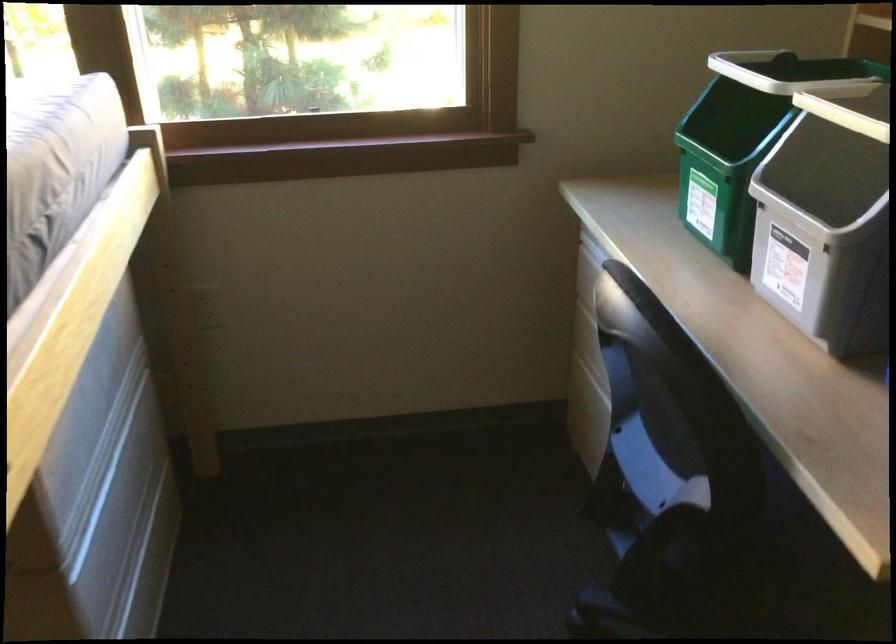
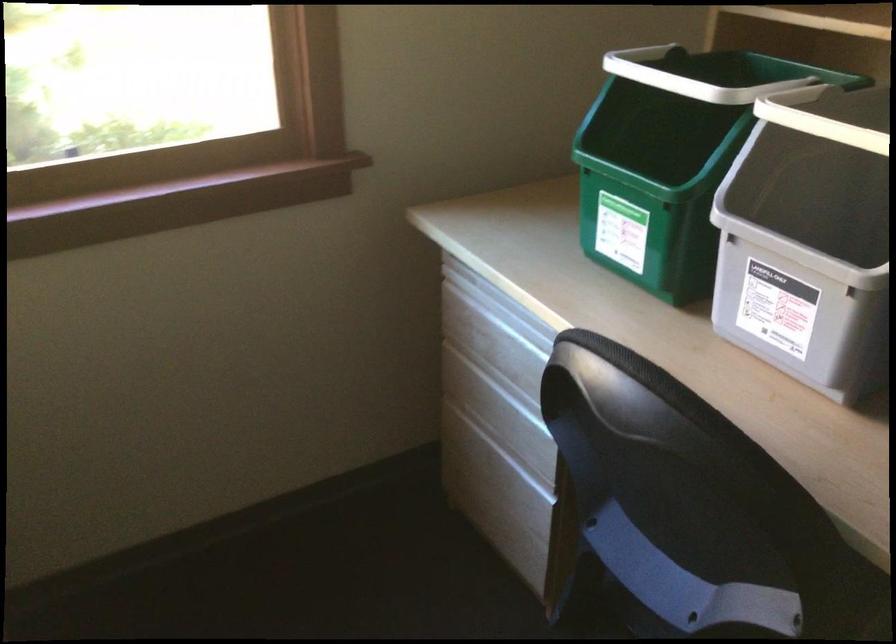
Looking at this image, in a continuous first-person perspective shot, in which direction is the camera moving?

The cameraman moved toward left, forward.